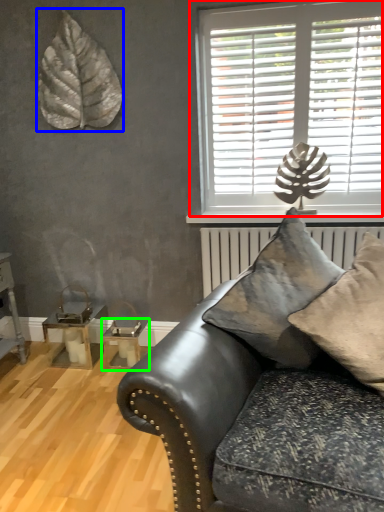
Question: Which is farther away from window (highlighted by a red box)? leaf (highlighted by a blue box) or table (highlighted by a green box)?

Choices:
 (A) leaf
 (B) table

Answer: (B)